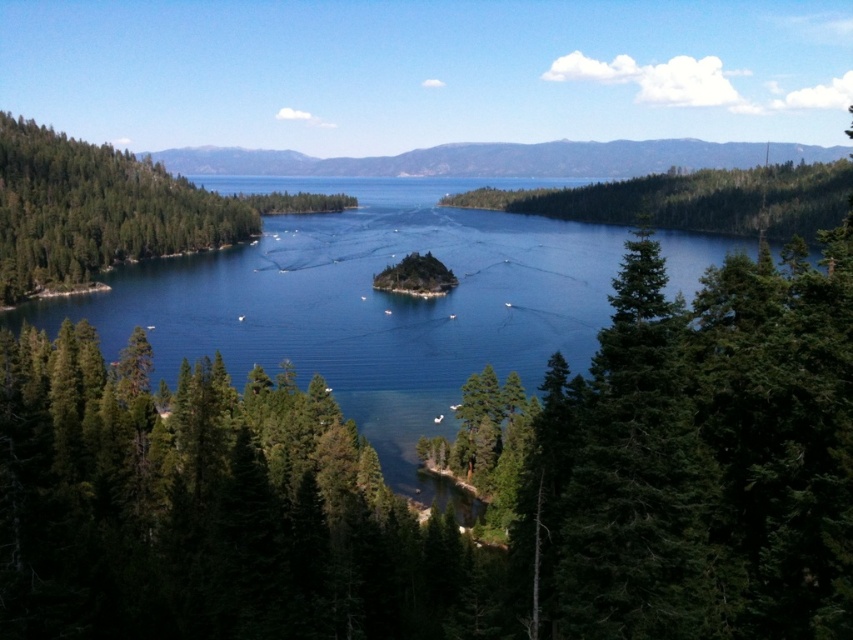
You are standing at the edge of the forest looking out towards the lake. Which object, the blue water at center or the green matte tree at left, is positioned lower in your field of view?

The blue water at center is located below the green matte tree at left, so it is positioned lower in your field of view.

You are standing at the edge of the lake and want to reach the small island. Which direction should you head towards from the blue water at center?

The blue water at center is located at point (369, 301). To reach the island, you should head towards the direction where the island is situated, which is near the center of the lake. However, the exact direction isn

You are a hiker who wants to cross from the left side of the green matte tree at left to the blue water at center. Which direction should you walk to avoid the dense forest?

You should walk towards the blue water at center because it is wider than the green matte tree at left, so there might be a path through the less dense area.